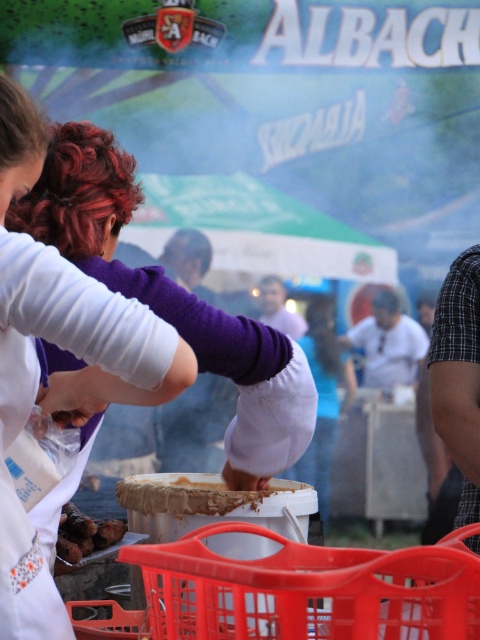
Question: Can you confirm if white matte bowl at center is positioned above white cotton shirt at center?

Choices:
 (A) yes
 (B) no

Answer: (B)

Question: Can you confirm if purple matte sweater at center is thinner than brown matte skewers at lower left?

Choices:
 (A) yes
 (B) no

Answer: (B)

Question: Can you confirm if purple matte sweater at center is wider than white matte bowl at center?

Choices:
 (A) no
 (B) yes

Answer: (A)

Question: Considering the real-world distances, which object is farthest from the brown matte skewers at lower left?

Choices:
 (A) white matte bowl at center
 (B) purple matte sweater at center

Answer: (B)

Question: Which of the following is the farthest from the observer?

Choices:
 (A) white fabric at center
 (B) purple matte sweater at center

Answer: (A)

Question: Which is farther from the white fabric at center?

Choices:
 (A) white matte bowl at center
 (B) white cotton shirt at center
 (C) brown matte skewers at lower left
 (D) purple matte sweater at center

Answer: (D)